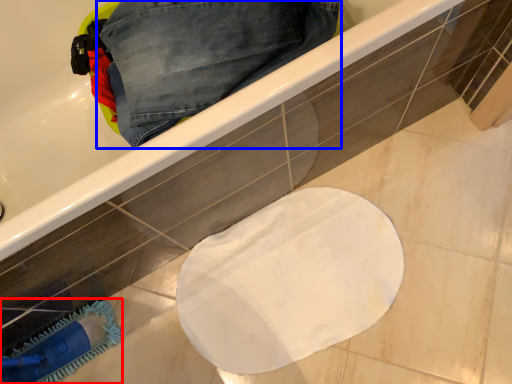
Question: Which object appears farthest to the camera in this image, brush (highlighted by a red box) or trousers (highlighted by a blue box)?

Choices:
 (A) brush
 (B) trousers

Answer: (A)